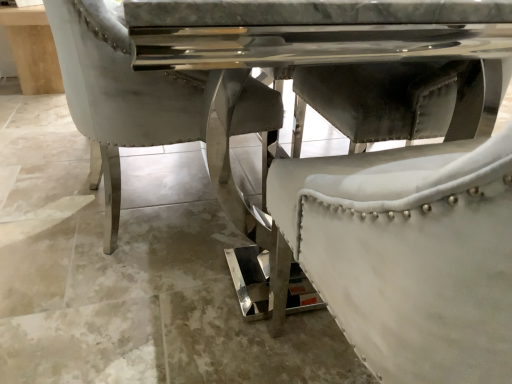
Question: From a real-world perspective, is white leather table at upper center above or below white leather chair at center?

Choices:
 (A) below
 (B) above

Answer: (B)

Question: Considering their positions, is white leather table at upper center located in front of or behind white leather chair at center?

Choices:
 (A) front
 (B) behind

Answer: (B)

Question: In terms of width, does white leather table at upper center look wider or thinner when compared to white leather chair at center?

Choices:
 (A) wide
 (B) thin

Answer: (B)

Question: Is point (188, 375) closer or farther from the camera than point (32, 29)?

Choices:
 (A) farther
 (B) closer

Answer: (B)

Question: From their relative heights in the image, would you say white leather chair at center is taller or shorter than white leather table at upper center?

Choices:
 (A) short
 (B) tall

Answer: (A)

Question: From the image's perspective, relative to white leather table at upper center, is white leather chair at center above or below?

Choices:
 (A) above
 (B) below

Answer: (B)

Question: Is white leather chair at center inside or outside of white leather table at upper center?

Choices:
 (A) inside
 (B) outside

Answer: (B)